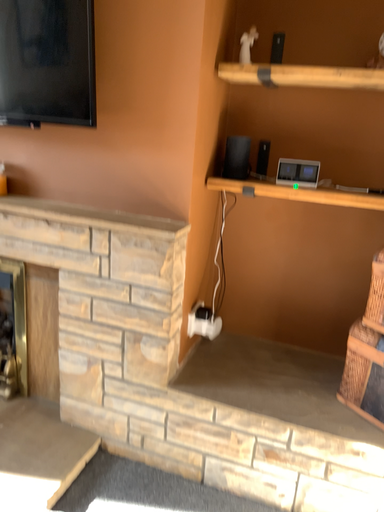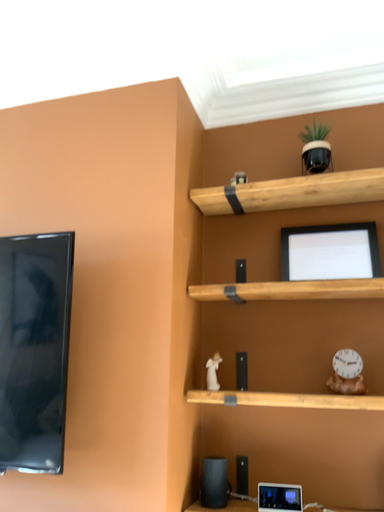
Question: How did the camera likely rotate when shooting the video?

Choices:
 (A) rotated downward
 (B) rotated upward

Answer: (B)